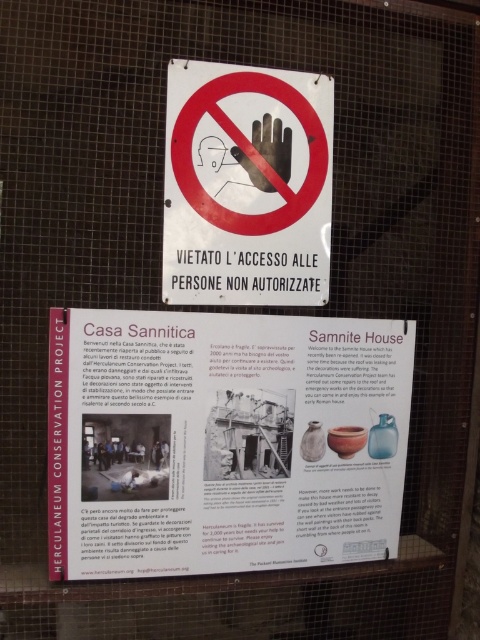
Question: Does white paper at center have a lesser width compared to matte white sign at center?

Choices:
 (A) yes
 (B) no

Answer: (B)

Question: Does white paper at center appear on the left side of matte white sign at center?

Choices:
 (A) no
 (B) yes

Answer: (B)

Question: Which point appears farthest from the camera in this image?

Choices:
 (A) (233, 452)
 (B) (323, 188)

Answer: (B)

Question: Among these objects, which one is farthest from the camera?

Choices:
 (A) matte white sign at center
 (B) white paper at center

Answer: (A)

Question: Is white paper at center positioned in front of matte white sign at center?

Choices:
 (A) yes
 (B) no

Answer: (A)

Question: Which point is farther to the camera?

Choices:
 (A) (265, 497)
 (B) (235, 76)

Answer: (A)